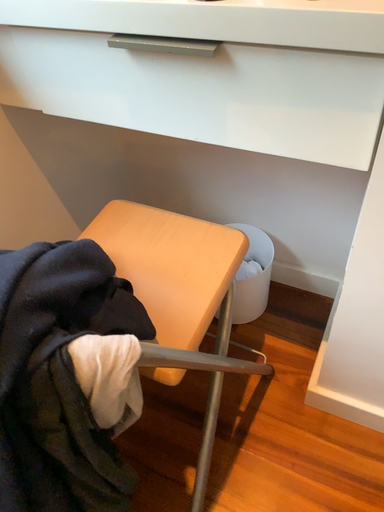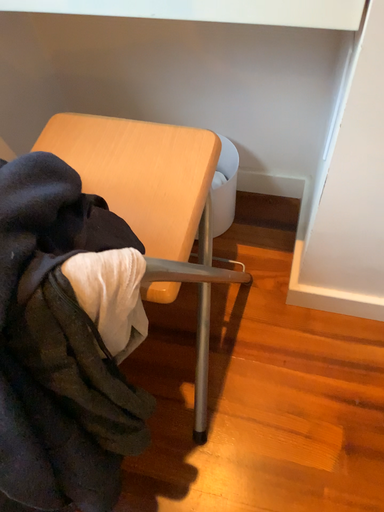
Question: How did the camera likely rotate when shooting the video?

Choices:
 (A) rotated downward
 (B) rotated upward

Answer: (A)